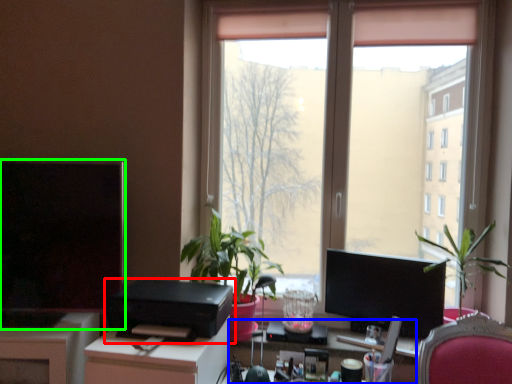
Question: Which is farther away from printer (highlighted by a red box)? computer desk (highlighted by a blue box) or computer monitor (highlighted by a green box)?

Choices:
 (A) computer desk
 (B) computer monitor

Answer: (A)